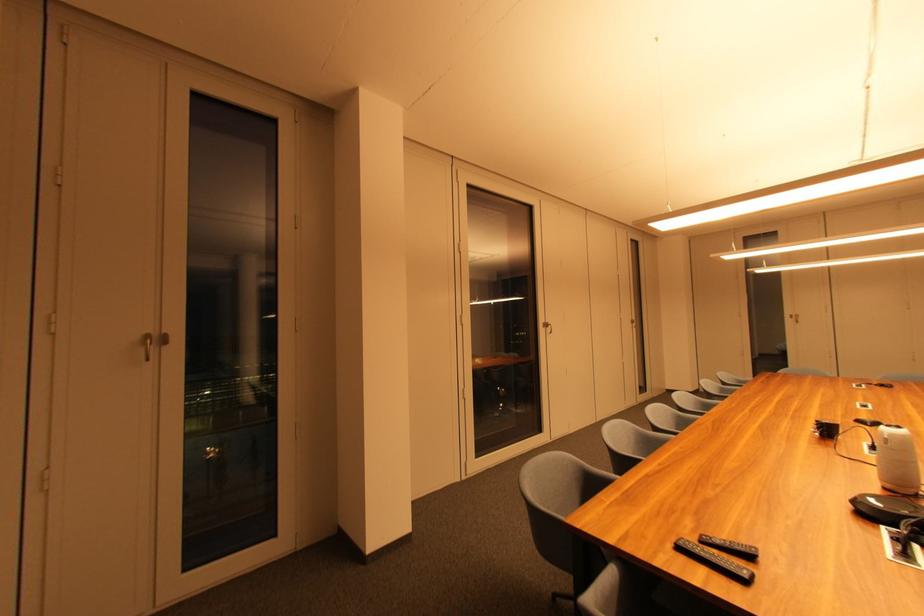
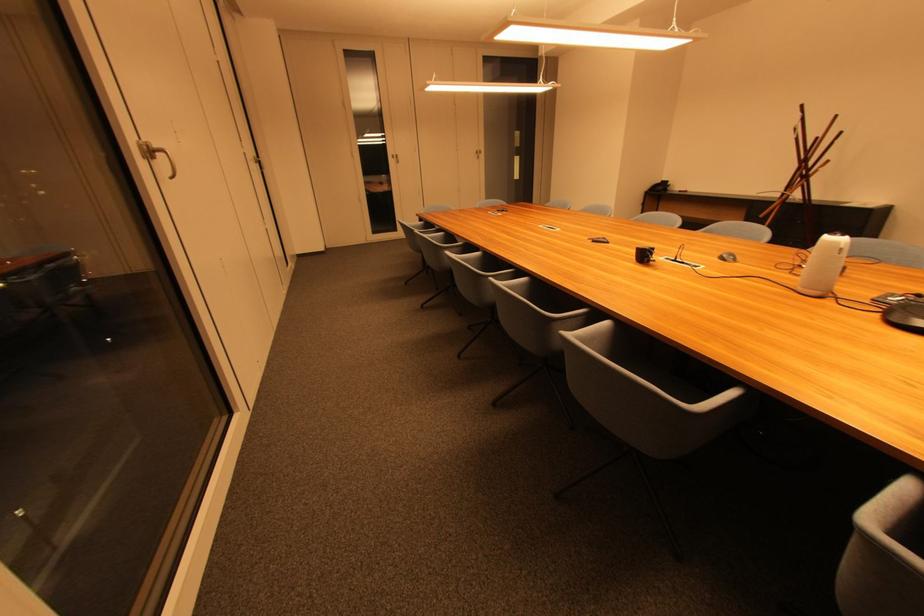
Where in the second image is the point corresponding to (x=889, y=435) from the first image?

(841, 245)